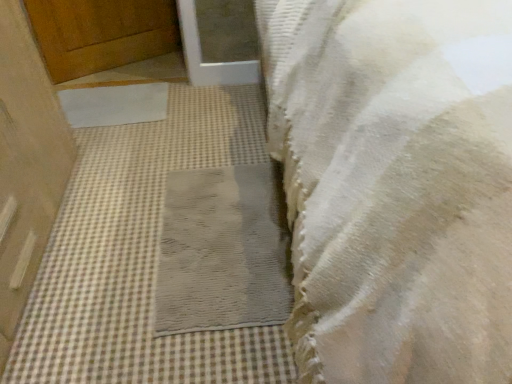
This screenshot has width=512, height=384. I want to click on vacant space situated on the left part of gray textured mat at center, placed as the 2th mat when sorted from left to right, so click(104, 234).